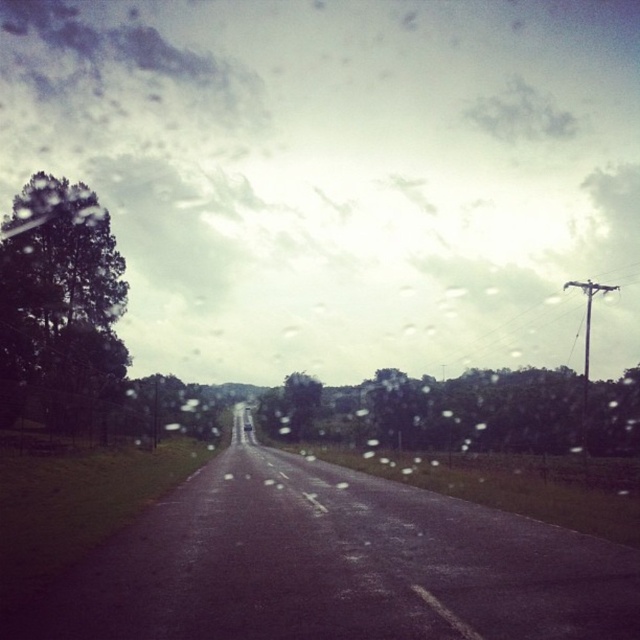
You are driving a car and see the cloudy sky at upper center and the metallic silver sedan at center ahead. Which object is located to the right of the other?

The cloudy sky at upper center is positioned on the right side of metallic silver sedan at center.

You are driving a car and looking through the windshield. You notice the cloudy sky at upper center and the metallic silver sedan at center. Which object is nearer to you?

The cloudy sky at upper center is closer to the viewer than the metallic silver sedan at center.

You are driving a car and want to know if the cloudy sky at upper center takes up more space in your view than the metallic silver sedan at center. Can you confirm this?

The cloudy sky at upper center is larger in size than the metallic silver sedan at center, so yes, the cloudy sky at upper center occupies more space in the view than the metallic silver sedan at center.